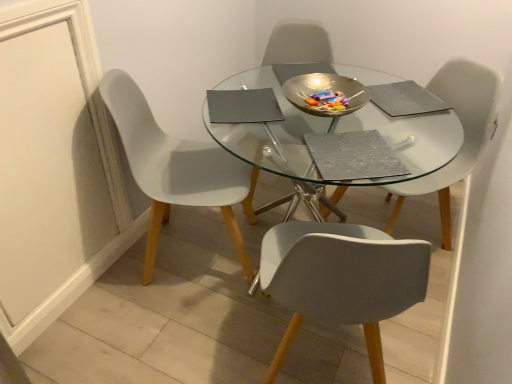
Question: From the image's perspective, is white plastic chair at center, which ranks as the third chair in left-to-right order, beneath metallic silver chair at center, marked as the 2th chair in a left-to-right arrangement?

Choices:
 (A) no
 (B) yes

Answer: (B)

Question: Is white plastic chair at center, which is the first chair in right-to-left order, touching metallic silver chair at center, which is the second chair from right to left?

Choices:
 (A) no
 (B) yes

Answer: (A)

Question: Is white plastic chair at center, which is the first chair in right-to-left order, smaller than metallic silver chair at center, which is the second chair from right to left?

Choices:
 (A) yes
 (B) no

Answer: (A)

Question: Can you confirm if white plastic chair at center, which is the first chair in right-to-left order, is positioned to the right of metallic silver chair at center, which is the second chair from right to left?

Choices:
 (A) no
 (B) yes

Answer: (B)

Question: Could metallic silver chair at center, which is the second chair from right to left, be considered to be inside white plastic chair at center, which ranks as the third chair in left-to-right order?

Choices:
 (A) no
 (B) yes

Answer: (A)

Question: From the image's perspective, is white plastic chair at center, which is the first chair in right-to-left order, located above metallic silver chair at center, marked as the 2th chair in a left-to-right arrangement?

Choices:
 (A) yes
 (B) no

Answer: (B)

Question: Is metallic silver chair at center, which is the second chair from right to left, facing towards white plastic chair at center, which is the first chair in right-to-left order?

Choices:
 (A) no
 (B) yes

Answer: (A)

Question: Considering the relative sizes of metallic silver chair at center, marked as the 2th chair in a left-to-right arrangement, and white plastic chair at center, which ranks as the third chair in left-to-right order, in the image provided, is metallic silver chair at center, marked as the 2th chair in a left-to-right arrangement, thinner than white plastic chair at center, which ranks as the third chair in left-to-right order,?

Choices:
 (A) yes
 (B) no

Answer: (B)

Question: From a real-world perspective, is metallic silver chair at center, marked as the 2th chair in a left-to-right arrangement, on white plastic chair at center, which ranks as the third chair in left-to-right order?

Choices:
 (A) no
 (B) yes

Answer: (B)

Question: From the image's perspective, is metallic silver chair at center, marked as the 2th chair in a left-to-right arrangement, over white plastic chair at center, which is the first chair in right-to-left order?

Choices:
 (A) yes
 (B) no

Answer: (A)

Question: From the image's perspective, would you say metallic silver chair at center, marked as the 2th chair in a left-to-right arrangement, is shown under white plastic chair at center, which ranks as the third chair in left-to-right order?

Choices:
 (A) yes
 (B) no

Answer: (B)

Question: Does metallic silver chair at center, which is the second chair from right to left, appear on the right side of white plastic chair at center, which is the first chair in right-to-left order?

Choices:
 (A) no
 (B) yes

Answer: (A)

Question: From the image's perspective, is white plastic chair at left, positioned as the first chair in left-to-right order, over metallic silver chair at center, which is the second chair from right to left?

Choices:
 (A) no
 (B) yes

Answer: (A)